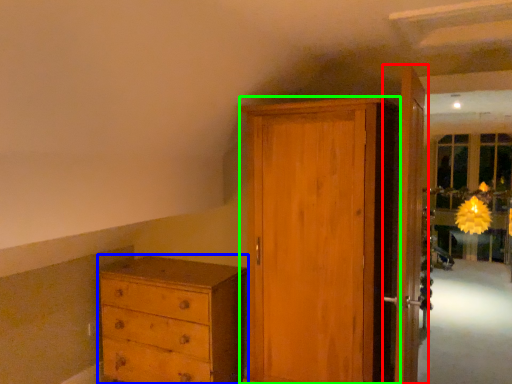
Question: Based on their relative distances, which object is nearer to door (highlighted by a red box)? Choose from chest of drawers (highlighted by a blue box) and door (highlighted by a green box).

Choices:
 (A) chest of drawers
 (B) door

Answer: (B)